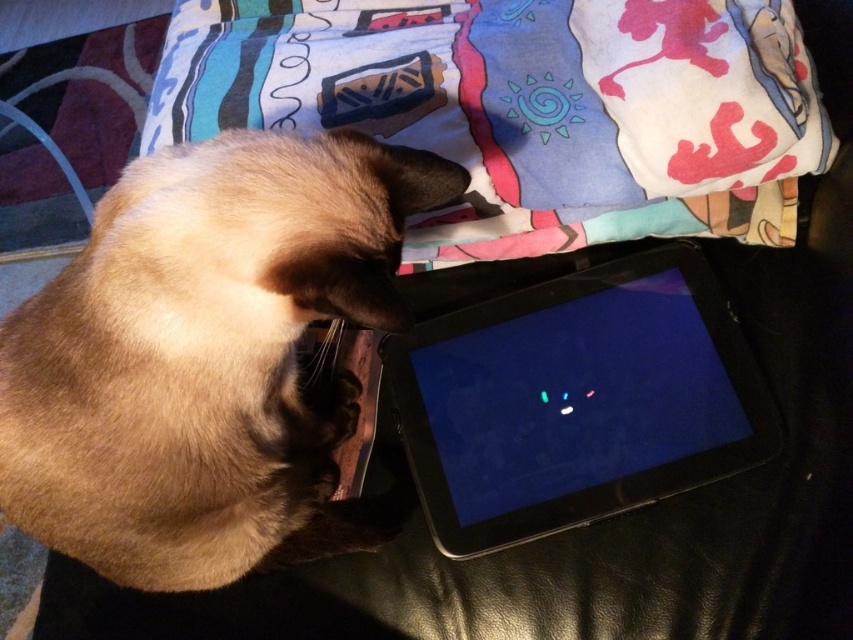
You are trying to determine if the satin beige cat at lower left can fit on the printed fabric pillow at upper center. Based on their sizes, can the cat lie entirely on the pillow without hanging off the edges?

The satin beige cat at lower left is narrower than the printed fabric pillow at upper center, so the cat can lie entirely on the pillow without hanging off the edges.

Looking at this image, you are trying to place a small toy on the black leather surface where the satin beige cat at lower left is sitting. Based on the cat

The satin beige cat at lower left is located at point (207, 356), so the toy should be placed away from that coordinate to avoid disturbing the cat.